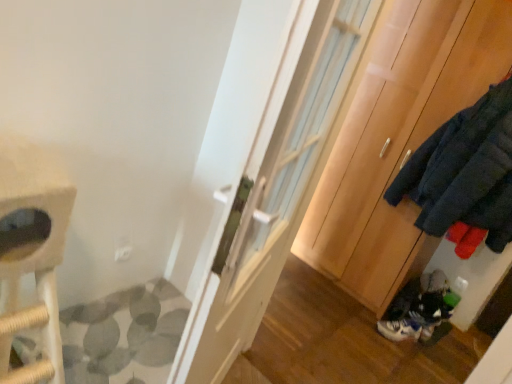
At what (x,y) coordinates should I click in order to perform the action: click on vacant region under white leather sneaker at lower right (from a real-world perspective). Please return your answer as a coordinate pair (x, y). The width and height of the screenshot is (512, 384). Looking at the image, I should click on (397, 338).